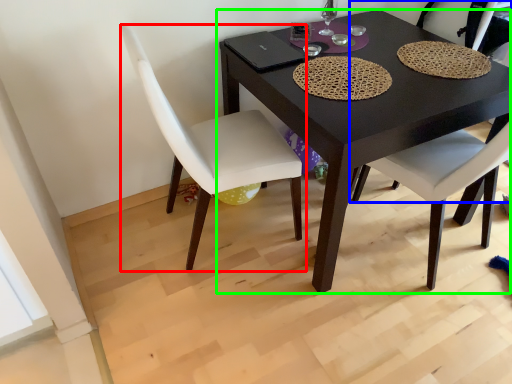
Question: Estimate the real-world distances between objects in this image. Which object is farther from chair (highlighted by a red box), chair (highlighted by a blue box) or table (highlighted by a green box)?

Choices:
 (A) chair
 (B) table

Answer: (A)